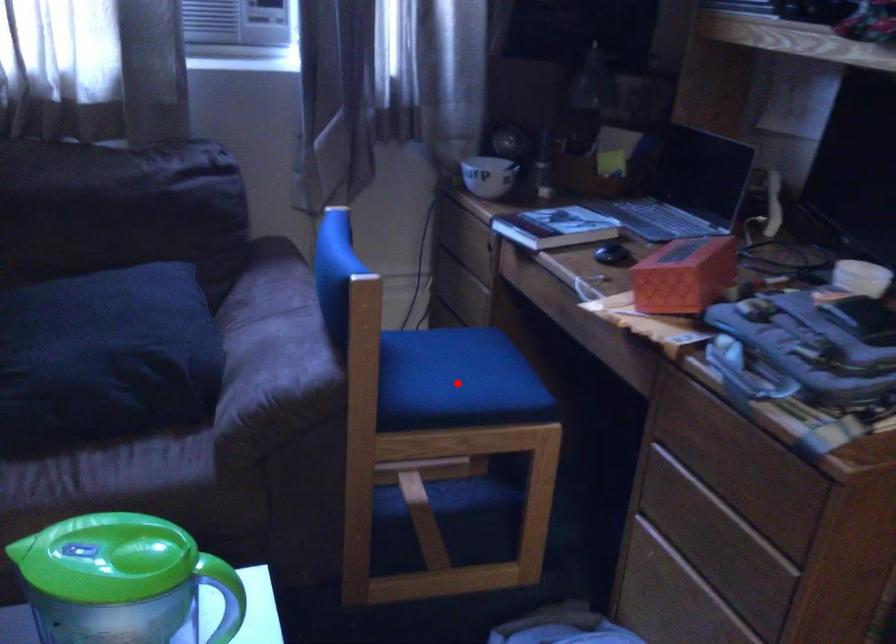
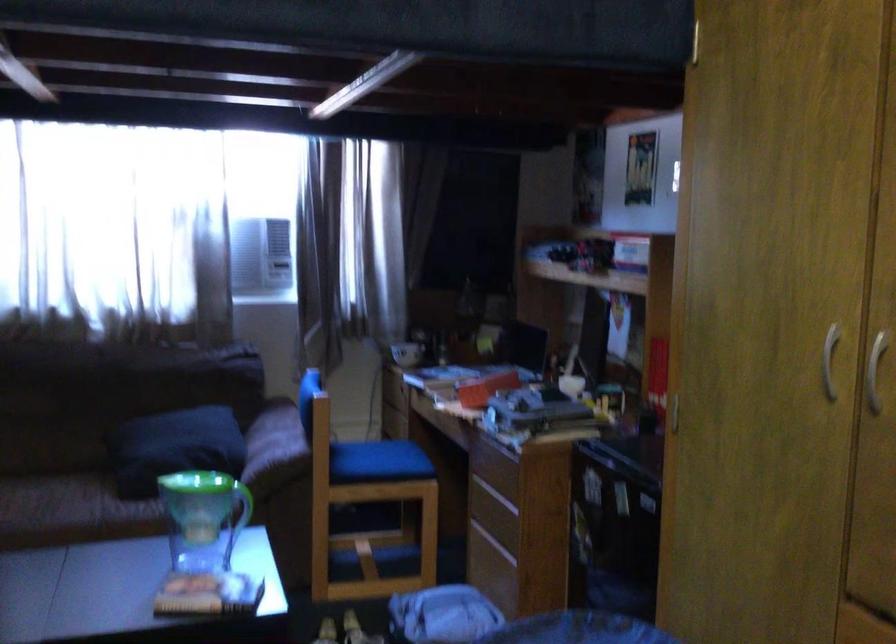
Question: I am providing you with two images of the same scene from different viewpoints. In image1, a red point is highlighted. Considering the same 3D point in image2, which of the following is correct?

Choices:
 (A) It is closer
 (B) It is farther

Answer: (B)